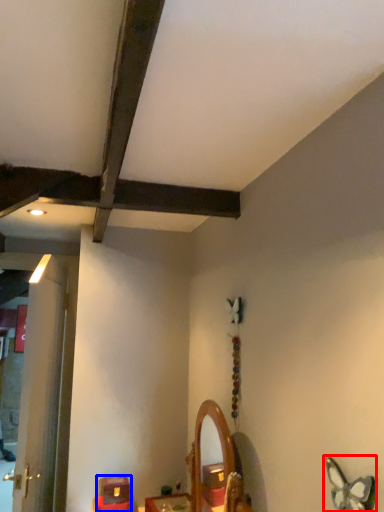
Question: Which object appears farthest to the camera in this image, butterfly (highlighted by a red box) or furniture (highlighted by a blue box)?

Choices:
 (A) butterfly
 (B) furniture

Answer: (B)